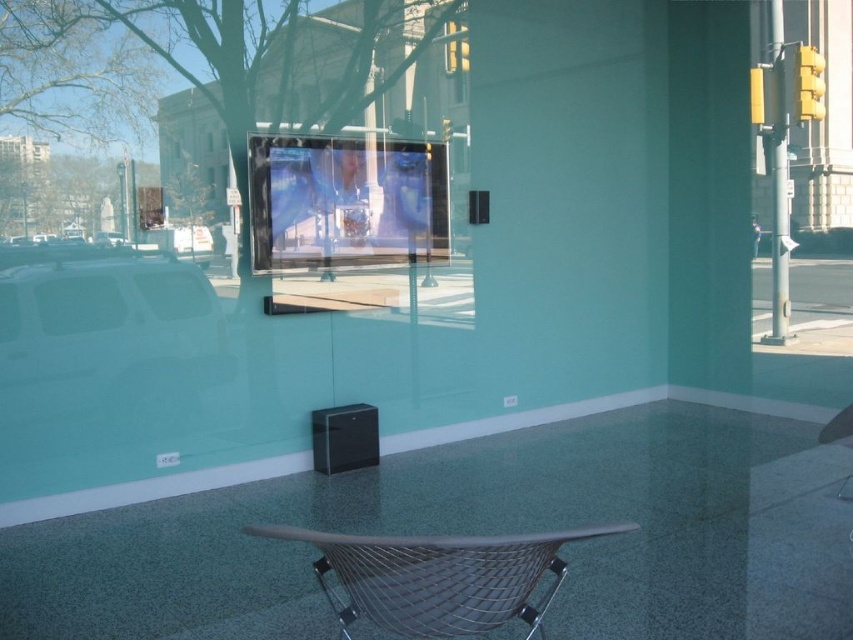
You are trying to move the metallic wire folding chair at center closer to the transparent glass window at center. Based on their widths, can the chair fit entirely within the window area without overlapping the edges?

The transparent glass window at center is wider than the metallic wire folding chair at center. Therefore, the chair can fit entirely within the window area without overlapping the edges.

You are standing in the room and want to touch both the transparent glass window at center and the metallic wire folding chair at center. Which object will you reach first?

You will reach the metallic wire folding chair at center first because it is closer to you than the transparent glass window at center, which is further away.